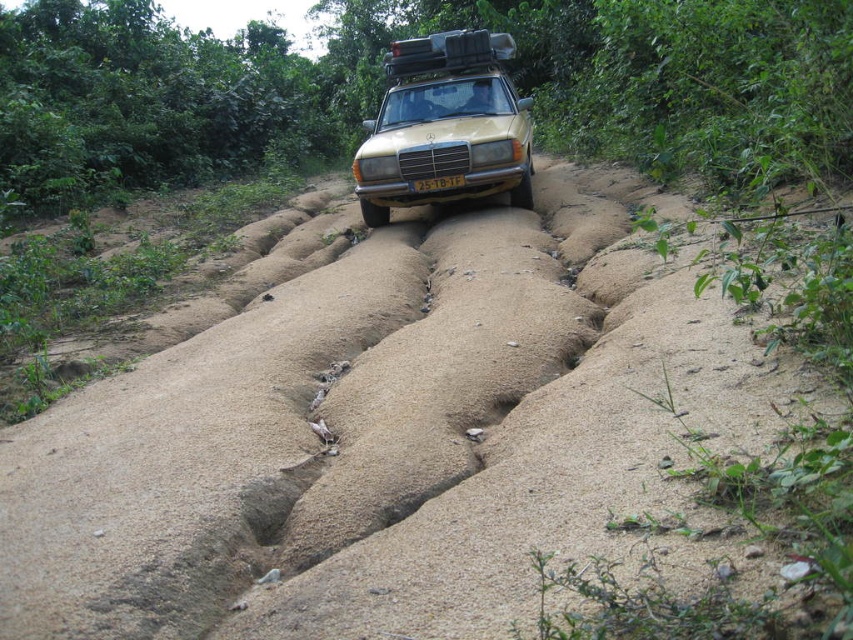
You are a photographer planning to take a photo of the gold matte car at center and the yellow matte license plate at center. If you want to ensure both are fully visible in the frame, which object should you focus on first considering their sizes?

The gold matte car at center is larger than the yellow matte license plate at center, so you should focus on the gold matte car at center first to ensure it fits properly in the frame before adjusting for the smaller license plate.

You are a driver trying to navigate the off road path in the image. You see the point marked at (x=445, y=125). What object is located at that point?

The point at (x=445, y=125) marks the gold matte car at center.